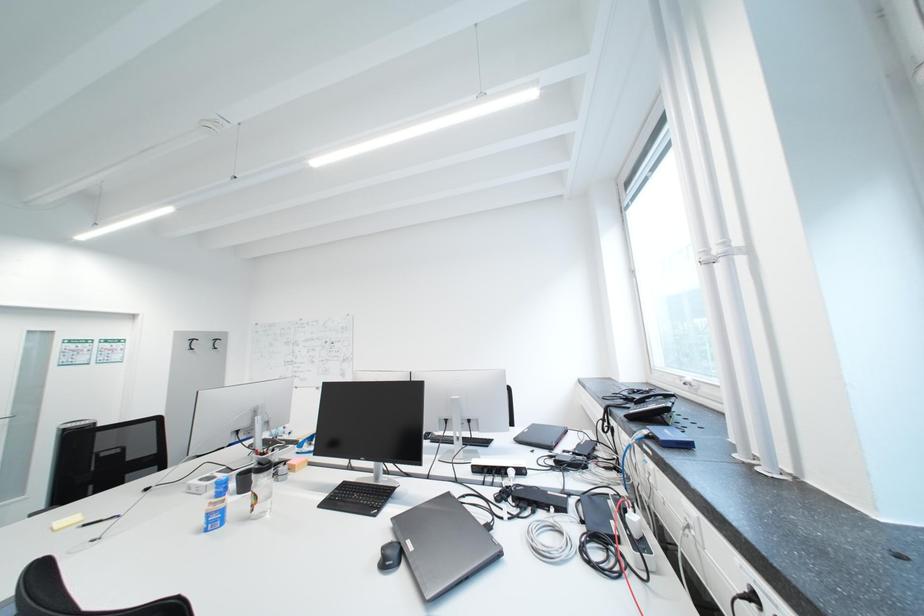
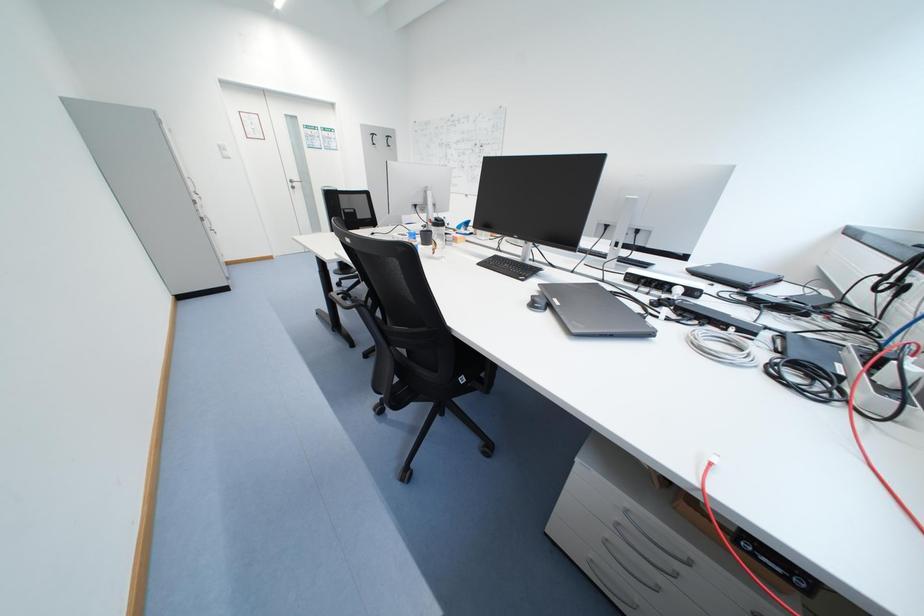
The first image is from the beginning of the video and the second image is from the end. How did the camera likely rotate when shooting the video?

The camera's rotation is toward left-down.